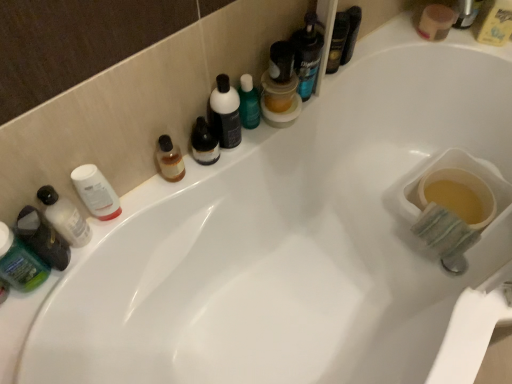
Question: From the image's perspective, relative to green matte lotion at left, arranged as the fourth toiletry when viewed from the right, is green matte bottle at left, which is the first mouthwash in left-to-right order, above or below?

Choices:
 (A) below
 (B) above

Answer: (A)

Question: Based on their sizes in the image, would you say green matte bottle at left, which is the first mouthwash in left-to-right order, is bigger or smaller than green matte lotion at left, arranged as the fourth toiletry when viewed from the right?

Choices:
 (A) small
 (B) big

Answer: (B)

Question: Considering the real-world distances, which object is farthest from the green matte lotion at left, arranged as the fourth toiletry when viewed from the right?

Choices:
 (A) translucent plastic mouthwash at upper center, the 2th mouthwash when ordered from top to bottom
 (B) matte black bottle at center, the fourth toiletry viewed from the left
 (C) translucent plastic jar at upper center, which is the third mouthwash from top to bottom
 (D) yellow plastic bottle at upper right, marked as the first mouthwash in a right-to-left arrangement
 (E) white matte lotion at left, the second toiletry viewed from the right

Answer: (D)

Question: Which is nearer to the translucent plastic bottle at left, which is the second toiletry from left to right?

Choices:
 (A) green matte bottle at left, positioned as the 1th mouthwash in front-to-back order
 (B) white matte lotion at left, the 3th toiletry when ordered from left to right
 (C) yellow plastic bottle at upper right, which is the first mouthwash from back to front
 (D) green matte lotion at left, arranged as the fourth toiletry when viewed from the right
 (E) translucent plastic jar at upper center, which is counted as the third mouthwash, starting from the right

Answer: (D)